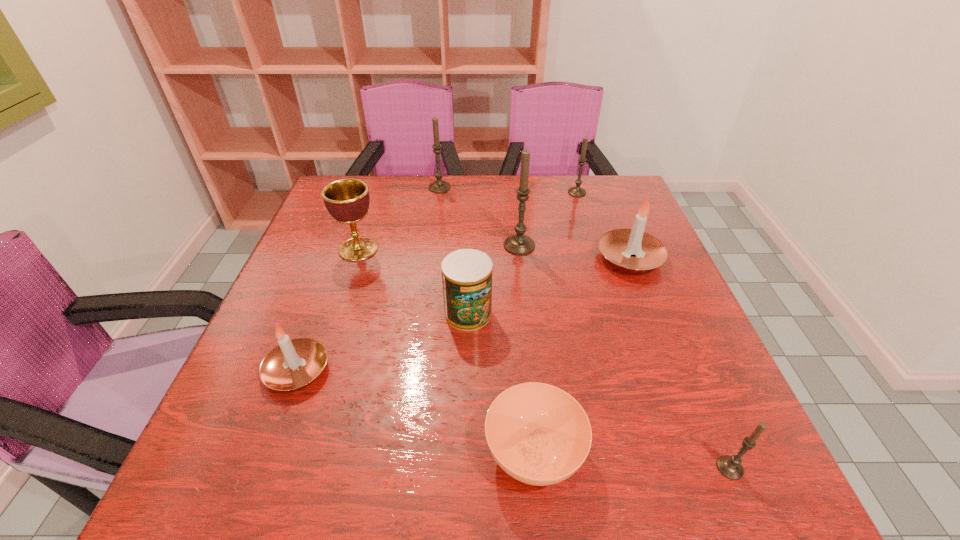
Identify the location of gray candle that is the third closest to the chalice. (577, 191).

Locate an element on the screen. The width and height of the screenshot is (960, 540). gray candle that is the second closest to the chalice is located at coordinates (519, 244).

Where is `free region that satisfies the following two spatial constraints: 1. on the back side of the golden chalice; 2. on the left side of the second gray candle from right to left`? free region that satisfies the following two spatial constraints: 1. on the back side of the golden chalice; 2. on the left side of the second gray candle from right to left is located at coordinates (377, 193).

Identify the location of vacant position in the image that satisfies the following two spatial constraints: 1. on the back side of the peach soup bowl; 2. on the left side of the tallest object. pos(515,245).

Locate an element on the screen. This screenshot has width=960, height=540. free region that satisfies the following two spatial constraints: 1. on the front side of the peach soup bowl; 2. on the right side of the smaller white candle is located at coordinates (266, 453).